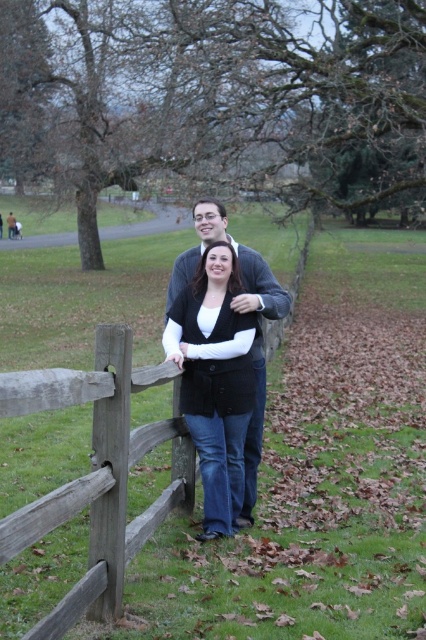
Which is above, brown wooden fence at center or black matte vest at center?

Positioned higher is black matte vest at center.

Does brown wooden fence at center lie behind black matte vest at center?

No, it is not.

This screenshot has width=426, height=640. I want to click on brown wooden fence at center, so click(x=98, y=472).